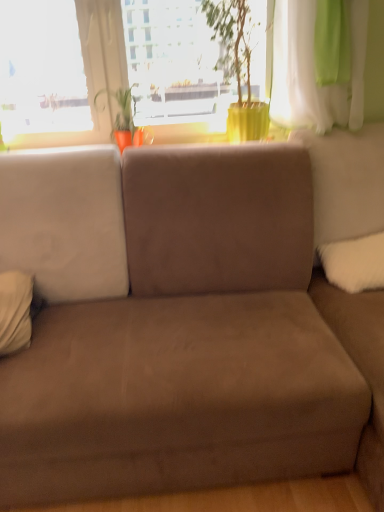
Question: Should I look upward or downward to see green matte plant pot at upper center?

Choices:
 (A) down
 (B) up

Answer: (B)

Question: Considering the relative positions of white fluffy pillow at right, acting as the 2th pillow starting from the left, and white soft pillow at left, which is counted as the second pillow, starting from the right, in the image provided, is white fluffy pillow at right, acting as the 2th pillow starting from the left, to the right of white soft pillow at left, which is counted as the second pillow, starting from the right, from the viewer's perspective?

Choices:
 (A) no
 (B) yes

Answer: (B)

Question: Does white fluffy pillow at right, the first pillow positioned from the right, have a smaller size compared to white soft pillow at left, which is counted as the second pillow, starting from the right?

Choices:
 (A) yes
 (B) no

Answer: (B)

Question: Is white fluffy pillow at right, acting as the 2th pillow starting from the left, beside white soft pillow at left, which is counted as the second pillow, starting from the right?

Choices:
 (A) yes
 (B) no

Answer: (B)

Question: Could you tell me if white fluffy pillow at right, acting as the 2th pillow starting from the left, is facing white soft pillow at left, which is counted as the second pillow, starting from the right?

Choices:
 (A) yes
 (B) no

Answer: (B)

Question: Could white soft pillow at left, which is counted as the second pillow, starting from the right, be considered to be inside white fluffy pillow at right, the first pillow positioned from the right?

Choices:
 (A) yes
 (B) no

Answer: (B)

Question: Can you confirm if white fluffy pillow at right, acting as the 2th pillow starting from the left, is shorter than white soft pillow at left, which is counted as the second pillow, starting from the right?

Choices:
 (A) no
 (B) yes

Answer: (B)

Question: Is green sheer curtain at upper right taller than transparent glass window at upper center?

Choices:
 (A) no
 (B) yes

Answer: (A)

Question: Considering the relative sizes of green sheer curtain at upper right and transparent glass window at upper center in the image provided, is green sheer curtain at upper right wider than transparent glass window at upper center?

Choices:
 (A) yes
 (B) no

Answer: (A)

Question: Is green sheer curtain at upper right at the left side of transparent glass window at upper center?

Choices:
 (A) no
 (B) yes

Answer: (A)

Question: From a real-world perspective, is green sheer curtain at upper right under transparent glass window at upper center?

Choices:
 (A) yes
 (B) no

Answer: (B)

Question: Would you consider green sheer curtain at upper right to be distant from transparent glass window at upper center?

Choices:
 (A) yes
 (B) no

Answer: (B)

Question: From the image's perspective, does green sheer curtain at upper right appear higher than transparent glass window at upper center?

Choices:
 (A) no
 (B) yes

Answer: (A)

Question: Is matte orange pot at center positioned beyond the bounds of green matte plant pot at upper center?

Choices:
 (A) no
 (B) yes

Answer: (B)